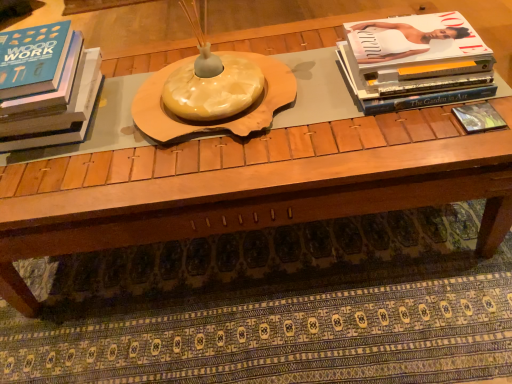
This screenshot has width=512, height=384. In order to click on vacant area that is in front of matte black book at right, the first book in the right-to-left sequence in this screenshot , I will do `click(483, 149)`.